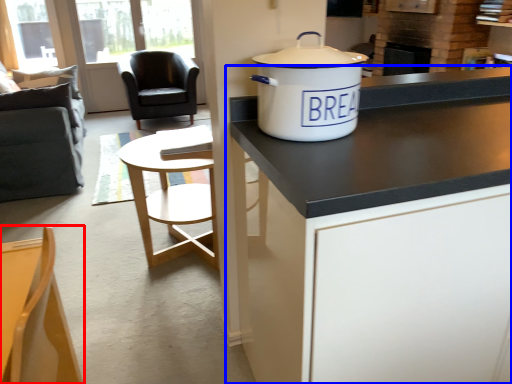
Question: Which object appears farthest to the camera in this image, chair (highlighted by a red box) or cabinetry (highlighted by a blue box)?

Choices:
 (A) chair
 (B) cabinetry

Answer: (B)